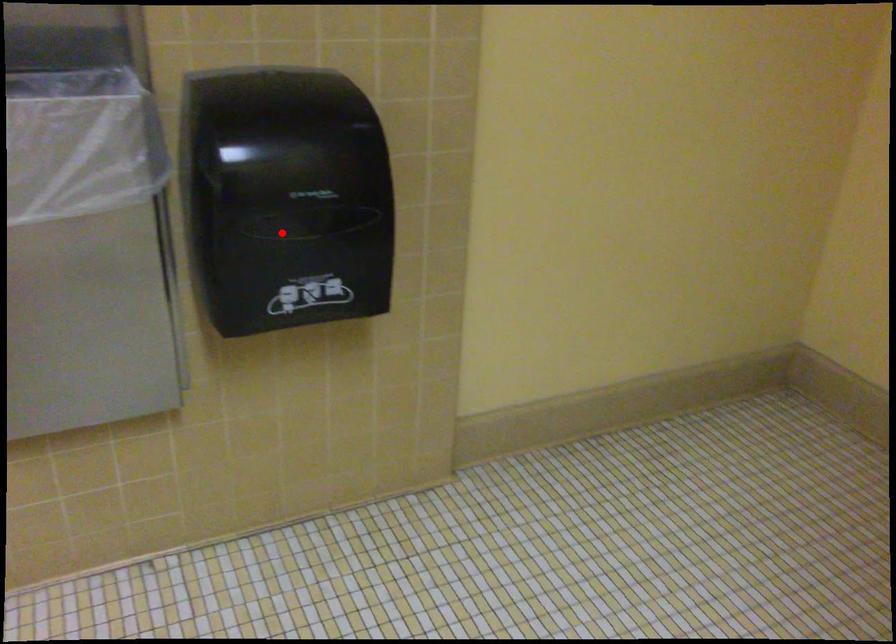
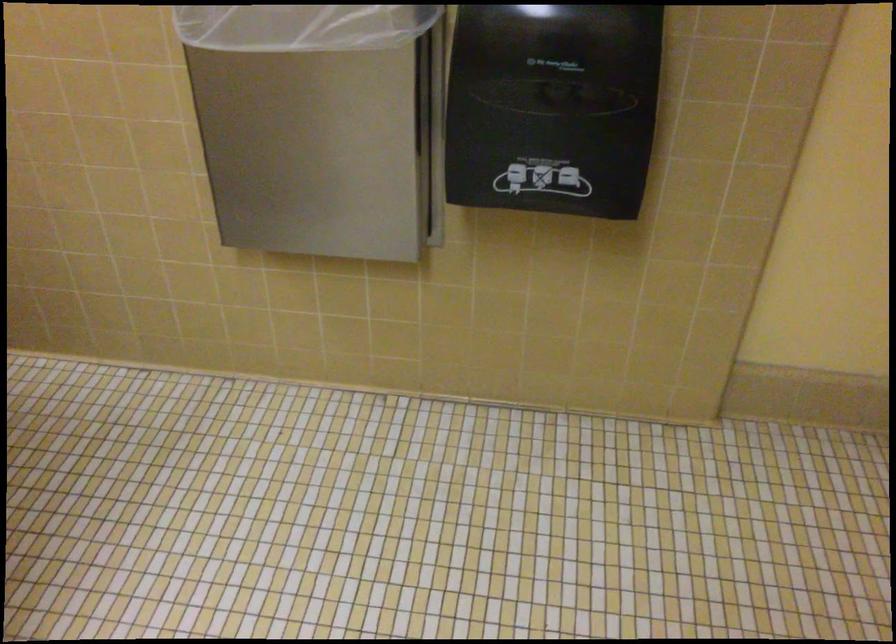
The point at the highlighted location is marked in the first image. Where is the corresponding point in the second image?

(552, 107)